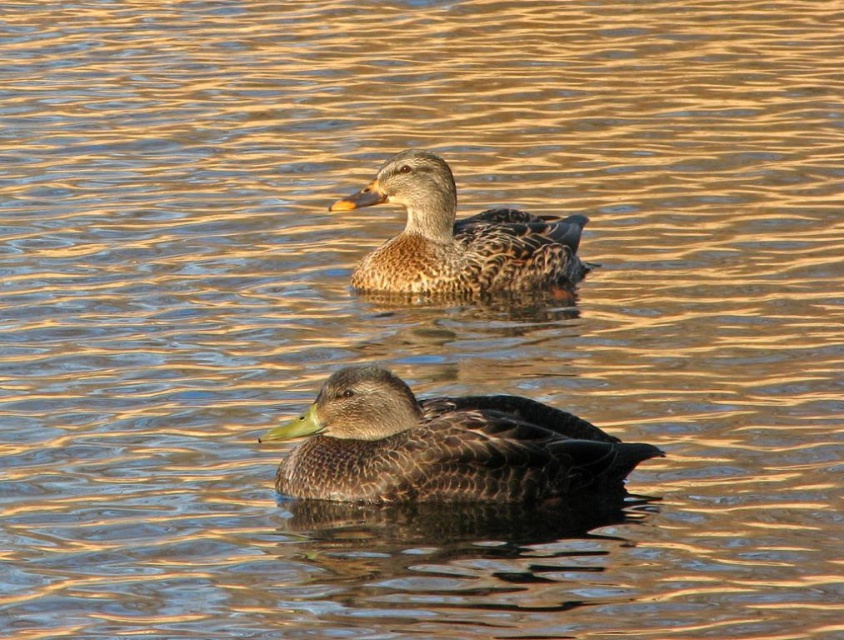
Question: Can you confirm if dark brown feathers at center is thinner than brown matte duck at upper center?

Choices:
 (A) no
 (B) yes

Answer: (A)

Question: Which object appears closest to the camera in this image?

Choices:
 (A) dark brown feathers at center
 (B) brown matte duck at upper center

Answer: (A)

Question: Does dark brown feathers at center appear on the left side of brown matte duck at upper center?

Choices:
 (A) no
 (B) yes

Answer: (A)

Question: Which of the following is the farthest from the observer?

Choices:
 (A) dark brown feathers at center
 (B) brown matte duck at upper center

Answer: (B)

Question: Does dark brown feathers at center have a greater width compared to brown matte duck at upper center?

Choices:
 (A) no
 (B) yes

Answer: (B)